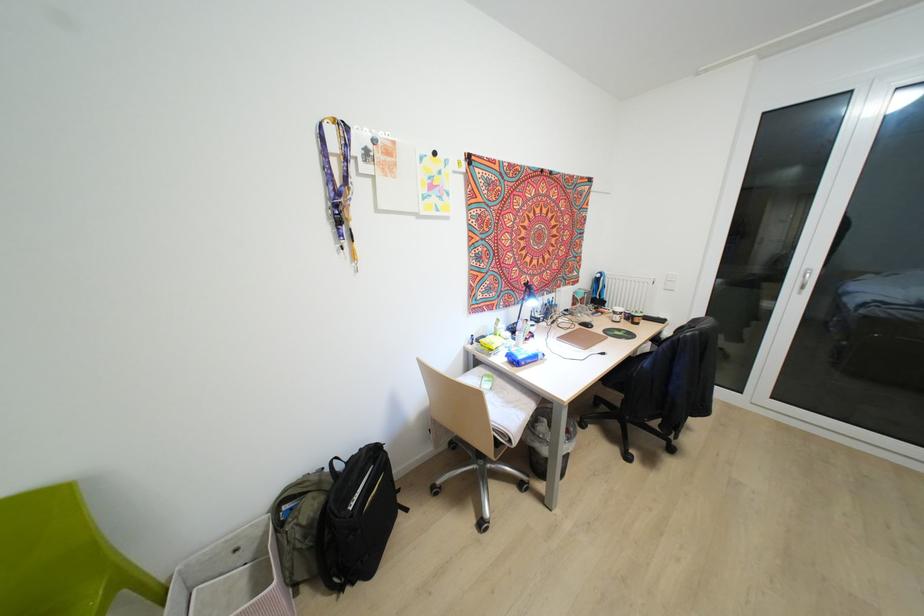
Find where to resting arm the black chair armrest. Please return your answer as a coordinate pair (x, y).

(608, 392)